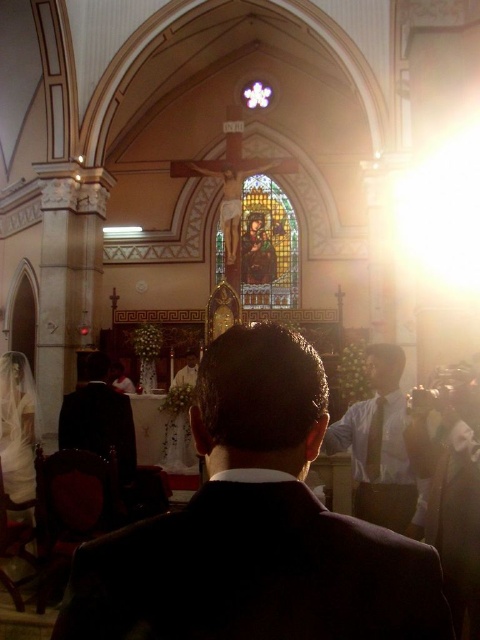
You are a photographer trying to capture the wedding ceremony. You notice the white shirt at center and the stained glass window at center. Which object takes up more area in the image?

The stained glass window at center takes up more area than the white shirt at center because the white shirt at center occupies less space than stained glass window at center.

In the church scene, there is a white shirt at center and a stained glass window at center. From the perspective of someone facing the altar, which object is positioned to the right?

The white shirt at center is to the right of the stained glass window at center.